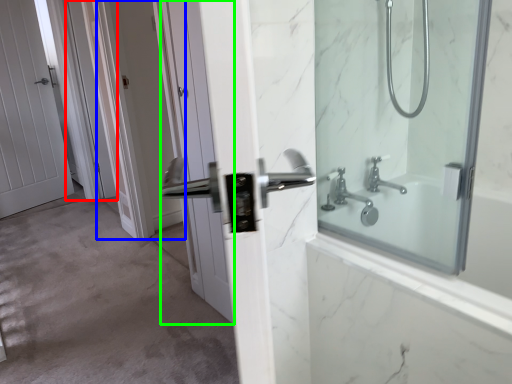
Question: Considering the real-world distances, which object is closest to screen door (highlighted by a red box)? screen door (highlighted by a blue box) or door (highlighted by a green box).

Choices:
 (A) screen door
 (B) door

Answer: (A)